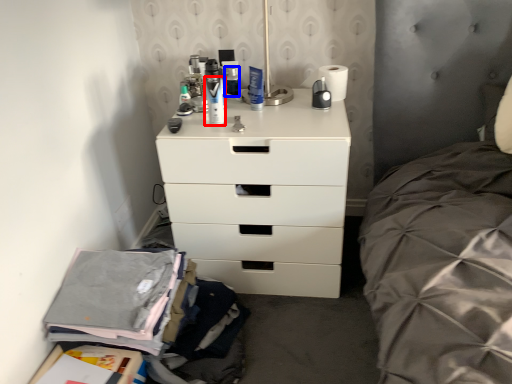
Question: Which object appears closest to the camera in this image, toiletry (highlighted by a red box) or toiletry (highlighted by a blue box)?

Choices:
 (A) toiletry
 (B) toiletry

Answer: (A)